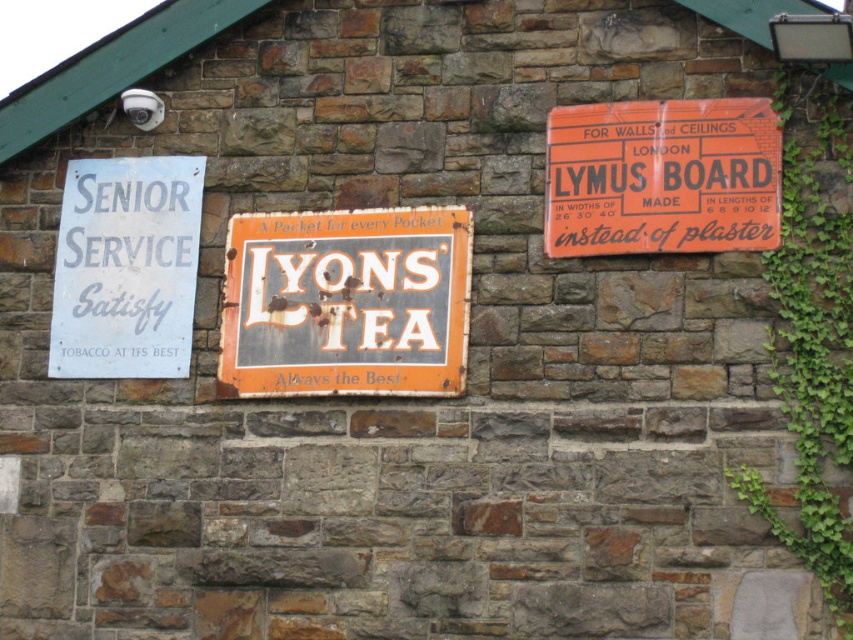
You are standing in front of the stone wall with three signs. You notice a point marked at coordinates (662, 177). Which sign is this point located on?

The point at coordinates (662, 177) is located on the orange cardboard sign at upper right.

You are standing in front of a stone wall with three signs. The rusty metal signboard at center is 42.24 meters away from you. Can you safely walk towards it without any obstacles? Please explain your reasoning based on the scene description.

The scene description mentions a stone wall with three signs but does not provide information about obstacles between you and the rusty metal signboard at center. Therefore, it is possible that there are no visible obstacles, but the absence of details means we cannot confirm safety with certainty.

You are a delivery person who needs to read all the signs on the stone wall. You see the orange cardboard sign at upper right and the white paper sign at left. Which sign is located to the right of the other?

The orange cardboard sign at upper right is positioned on the right side of white paper sign at left.